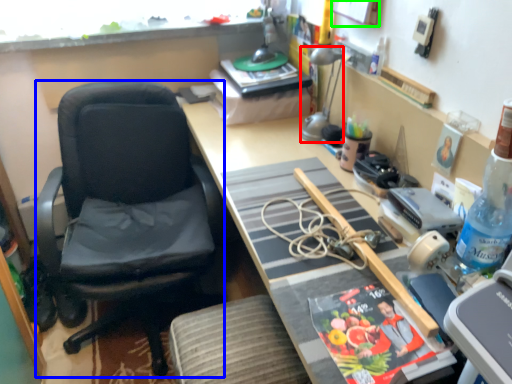
Question: Which object is positioned closest to lamp (highlighted by a red box)? Select from chair (highlighted by a blue box) and picture frame (highlighted by a green box).

Choices:
 (A) chair
 (B) picture frame

Answer: (B)